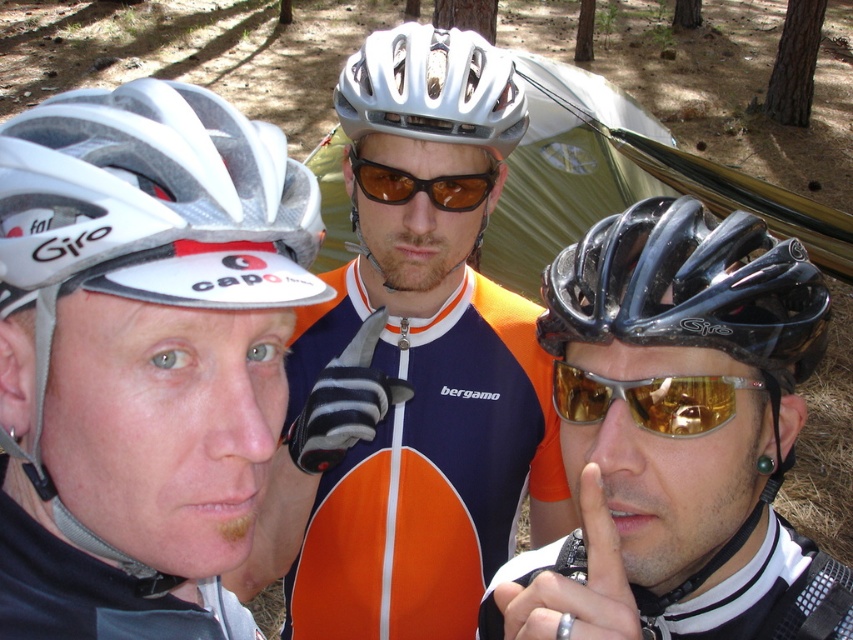
Can you confirm if matte white helmet at center is bigger than black glossy helmet at center?

Yes.

Is matte white helmet at center smaller than black glossy helmet at center?

Incorrect, matte white helmet at center is not smaller in size than black glossy helmet at center.

Between point (270, 579) and point (759, 364), which one is positioned in front?

Positioned in front is point (759, 364).

The image size is (853, 640). Find the location of `matte white helmet at center`. matte white helmet at center is located at coordinates (412, 365).

Can you confirm if white matte bicycle helmet at center is smaller than brown reflective sunglasses at center?

No, white matte bicycle helmet at center is not smaller than brown reflective sunglasses at center.

Who is shorter, white matte bicycle helmet at center or brown reflective sunglasses at center?

brown reflective sunglasses at center is shorter.

This screenshot has height=640, width=853. I want to click on white matte bicycle helmet at center, so click(x=432, y=88).

Locate an element on the screen. The height and width of the screenshot is (640, 853). white matte bicycle helmet at center is located at coordinates (432, 88).

In the scene shown: Is white matte bicycle helmet at left taller than gold reflective lens at center?

Indeed, white matte bicycle helmet at left has a greater height compared to gold reflective lens at center.

Is point (244, 307) positioned behind point (694, 417)?

No, it is not.

Identify the location of white matte bicycle helmet at left. The height and width of the screenshot is (640, 853). (142, 244).